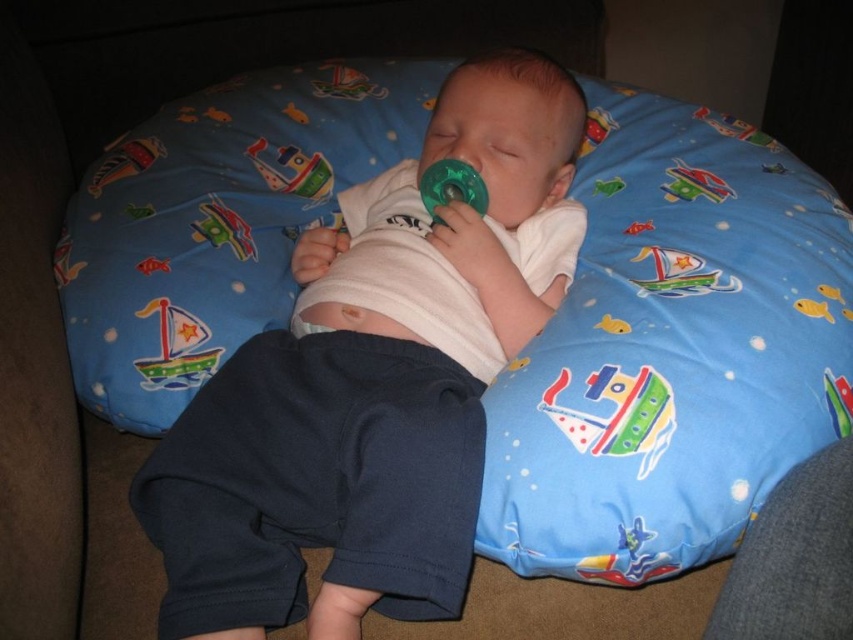
Between green plastic airplane at upper left and green plastic pacifier at upper center, which one has less height?

green plastic pacifier at upper center

Who is positioned more to the right, green plastic airplane at upper left or green plastic pacifier at upper center?

green plastic pacifier at upper center

Locate an element on the screen. The width and height of the screenshot is (853, 640). green plastic airplane at upper left is located at coordinates (223, 228).

Who is more distant from viewer, (428,205) or (685,189)?

Positioned behind is point (428,205).

Which is in front, point (418, 192) or point (718, 193)?

Positioned in front is point (718, 193).

Does point (465, 189) come closer to viewer compared to point (672, 170)?

Yes, it is in front of point (672, 170).

Locate an element on the screen. The height and width of the screenshot is (640, 853). green translucent pacifier at center is located at coordinates (451, 186).

Is green plastic airplane at upper left to the left of matte plastic boat at upper center from the viewer's perspective?

Correct, you'll find green plastic airplane at upper left to the left of matte plastic boat at upper center.

Does green plastic airplane at upper left have a smaller size compared to matte plastic boat at upper center?

Correct, green plastic airplane at upper left occupies less space than matte plastic boat at upper center.

Describe the element at coordinates (223, 228) in the screenshot. The image size is (853, 640). I see `green plastic airplane at upper left` at that location.

Identify the location of green plastic airplane at upper left. The height and width of the screenshot is (640, 853). (223, 228).